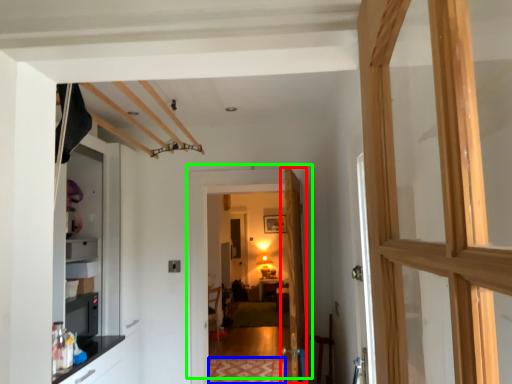
Question: Estimate the real-world distances between objects in this image. Which object is farther from door (highlighted by a red box), mat (highlighted by a blue box) or door (highlighted by a green box)?

Choices:
 (A) mat
 (B) door

Answer: (A)